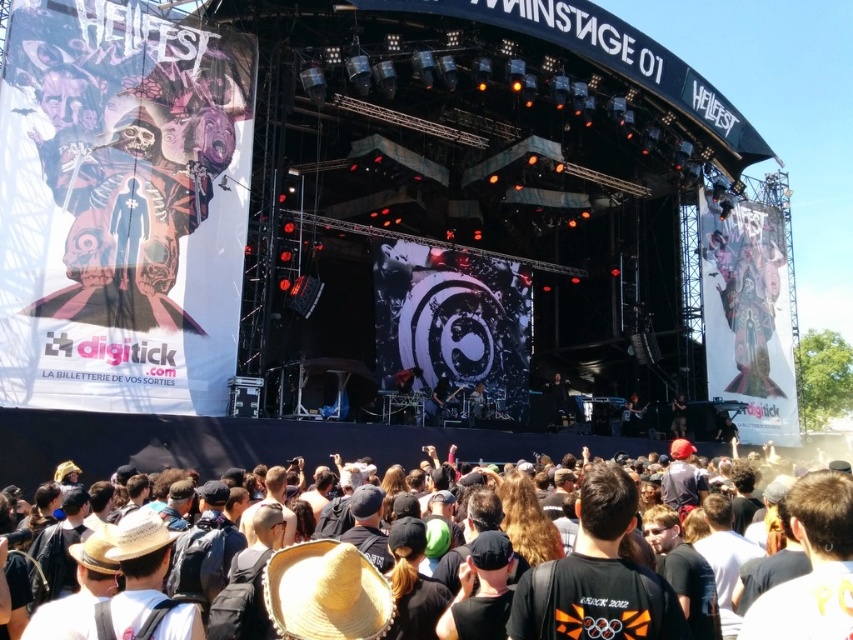
Does black fabric crowd at lower center have a lesser width compared to dark brown leather guitar at lower right?

No.

Between black fabric crowd at lower center and dark brown leather guitar at lower right, which one is positioned lower?

dark brown leather guitar at lower right

Image resolution: width=853 pixels, height=640 pixels. Describe the element at coordinates (88, 449) in the screenshot. I see `black fabric crowd at lower center` at that location.

Find the location of a particular element. The image size is (853, 640). black fabric crowd at lower center is located at coordinates (88, 449).

Can you confirm if matte black poster at upper right is positioned to the right of dark brown leather guitar at lower right?

Indeed, matte black poster at upper right is positioned on the right side of dark brown leather guitar at lower right.

Is matte black poster at upper right closer to camera compared to dark brown leather guitar at lower right?

That is False.

Does point (714, 358) come behind point (634, 412)?

Yes, it is behind point (634, 412).

This screenshot has width=853, height=640. I want to click on matte black poster at upper right, so 746,301.

Measure the distance between point (804, 525) and camera.

They are 35.94 meters apart.

Is point (241, 432) positioned after point (780, 241)?

No, (241, 432) is closer to viewer.

Who is more distant from viewer, (625, 616) or (738, 332)?

The point (738, 332) is more distant.

The image size is (853, 640). Identify the location of black fabric crowd at lower center. (88, 449).